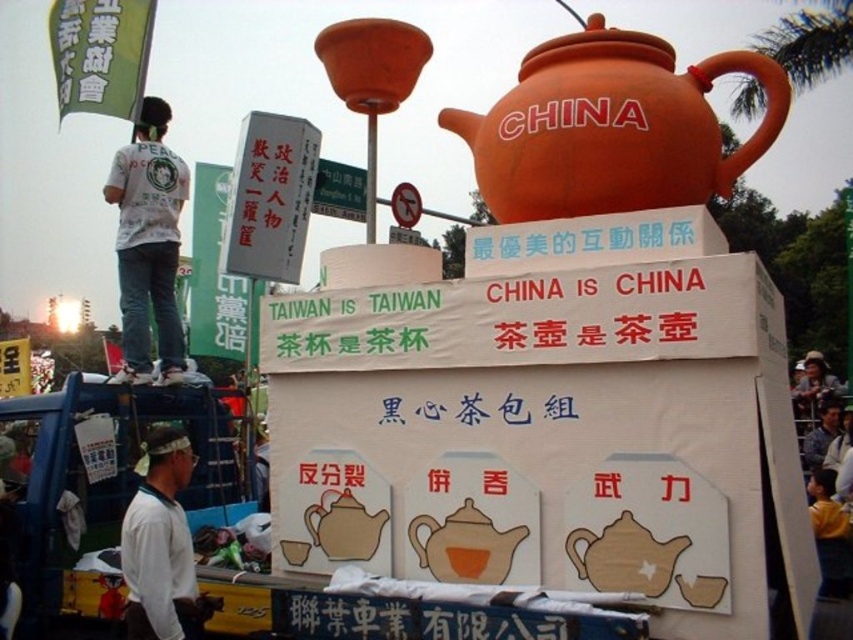
Does matte orange clay teapot at upper center appear under blue denim shirt at lower right?

Actually, matte orange clay teapot at upper center is above blue denim shirt at lower right.

How far apart are matte orange clay teapot at upper center and blue denim shirt at lower right?

matte orange clay teapot at upper center and blue denim shirt at lower right are 45.84 meters apart.

Identify the location of matte orange clay teapot at upper center. This screenshot has width=853, height=640. (611, 128).

Locate an element on the screen. matte orange clay teapot at upper center is located at coordinates (611, 128).

Can you confirm if matte orange clay teapot at upper center is bigger than matte brown teapot at center?

Yes, matte orange clay teapot at upper center is bigger than matte brown teapot at center.

Is point (722, 72) less distant than point (315, 512)?

No, it is not.

The height and width of the screenshot is (640, 853). Identify the location of matte orange clay teapot at upper center. (611, 128).

Who is taller, white cotton shirt at left or matte orange teapot at center?

Standing taller between the two is white cotton shirt at left.

Does white cotton shirt at left have a smaller size compared to matte orange teapot at center?

No, white cotton shirt at left is not smaller than matte orange teapot at center.

The image size is (853, 640). Describe the element at coordinates (148, 244) in the screenshot. I see `white cotton shirt at left` at that location.

Locate an element on the screen. This screenshot has width=853, height=640. white cotton shirt at left is located at coordinates (148, 244).